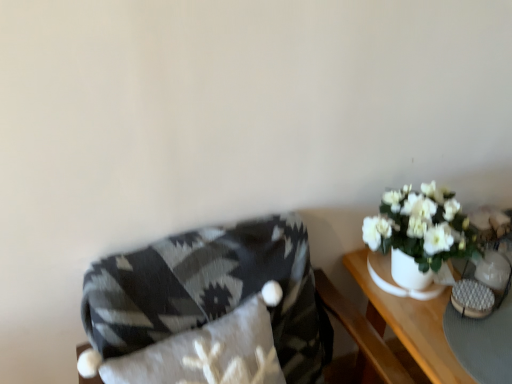
You are a GUI agent. You are given a task and a screenshot of the screen. Output one action in this format:
    pyautogui.click(x=<x>, y=<y>)
    Task: Click on the vacant area in front of white ceramic vase at right
    This screenshot has height=384, width=512.
    Given the screenshot: What is the action you would take?
    pyautogui.click(x=445, y=335)